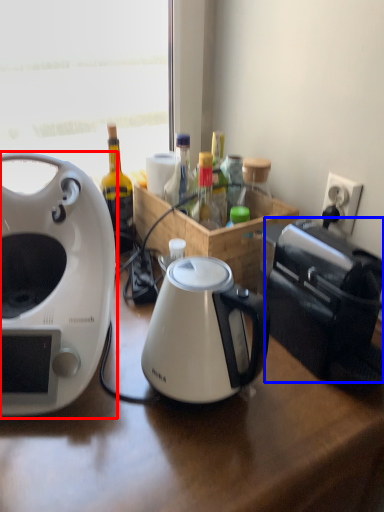
Question: Which object appears farthest to the camera in this image, coffee maker (highlighted by a red box) or toaster (highlighted by a blue box)?

Choices:
 (A) coffee maker
 (B) toaster

Answer: (B)